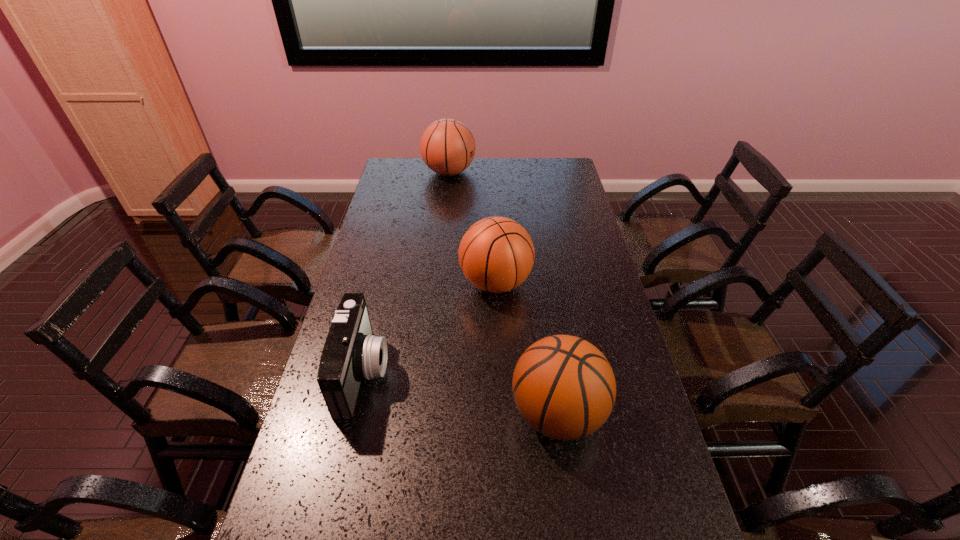
Find the location of a particular element. The height and width of the screenshot is (540, 960). object present at the right edge is located at coordinates (564, 387).

Locate an element on the screen. free space at the left edge of the desktop is located at coordinates (379, 194).

Image resolution: width=960 pixels, height=540 pixels. In the image, there is a desktop. Find the location of `vacant space at the right edge`. vacant space at the right edge is located at coordinates (570, 312).

Find the location of a particular element. free area in between the nearest basketball and the farthest object is located at coordinates (503, 293).

The width and height of the screenshot is (960, 540). In order to click on free spot between the farthest object and the camcorder in this screenshot , I will do `click(406, 272)`.

Identify the location of vacant area that lies between the farthest object and the nearest basketball. This screenshot has width=960, height=540. 503,293.

Locate an element on the screen. This screenshot has height=540, width=960. vacant space that's between the second nearest basketball and the nearest basketball is located at coordinates (527, 348).

You are a GUI agent. You are given a task and a screenshot of the screen. Output one action in this format:
    pyautogui.click(x=<x>, y=<y>)
    Task: Click on the free spot between the farthest object and the nearest basketball
    
    Given the screenshot: What is the action you would take?
    pyautogui.click(x=503, y=293)

Where is `object identified as the closest to the second farthest object`? The image size is (960, 540). object identified as the closest to the second farthest object is located at coordinates pyautogui.click(x=351, y=352).

Identify which object is located as the nearest to the shortest object. Please provide its 2D coordinates. Your answer should be formatted as a tuple, i.e. [(x, y)], where the tuple contains the x and y coordinates of a point satisfying the conditions above.

[(496, 254)]